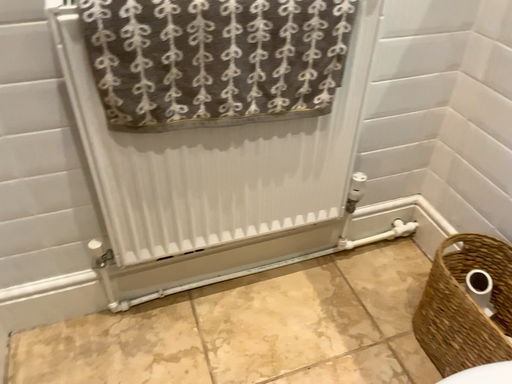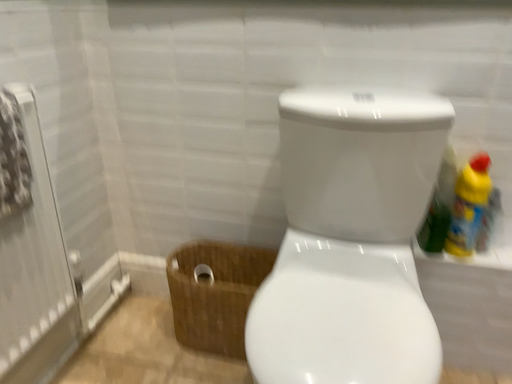
Question: Which way did the camera rotate in the video?

Choices:
 (A) rotated downward
 (B) rotated upward

Answer: (B)